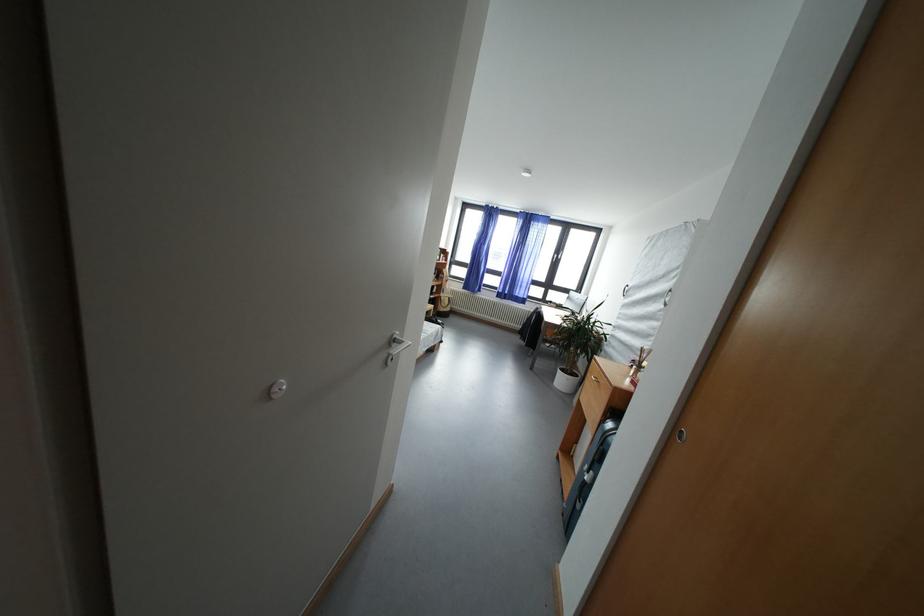
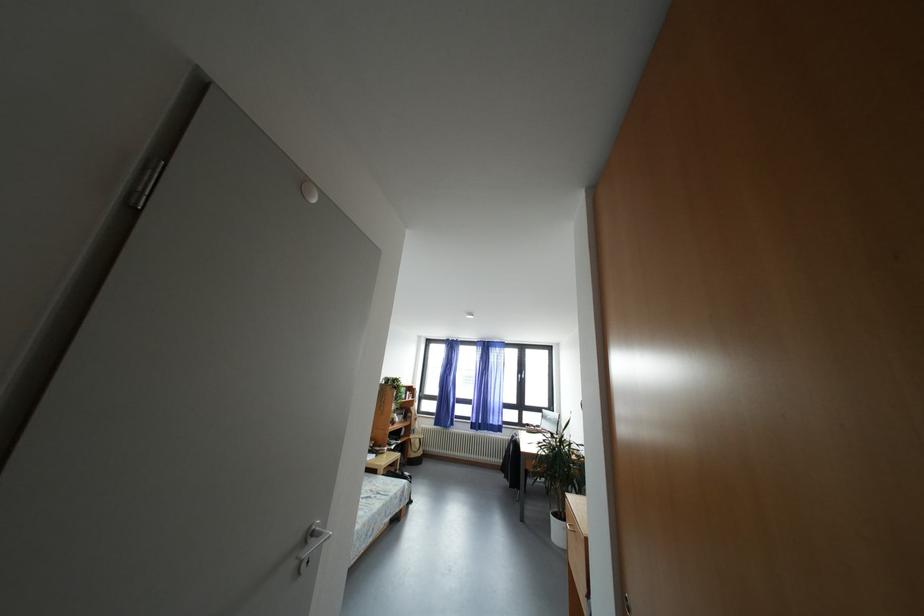
The point at [569,375] is marked in the first image. Where is the corresponding point in the second image?

(562, 519)